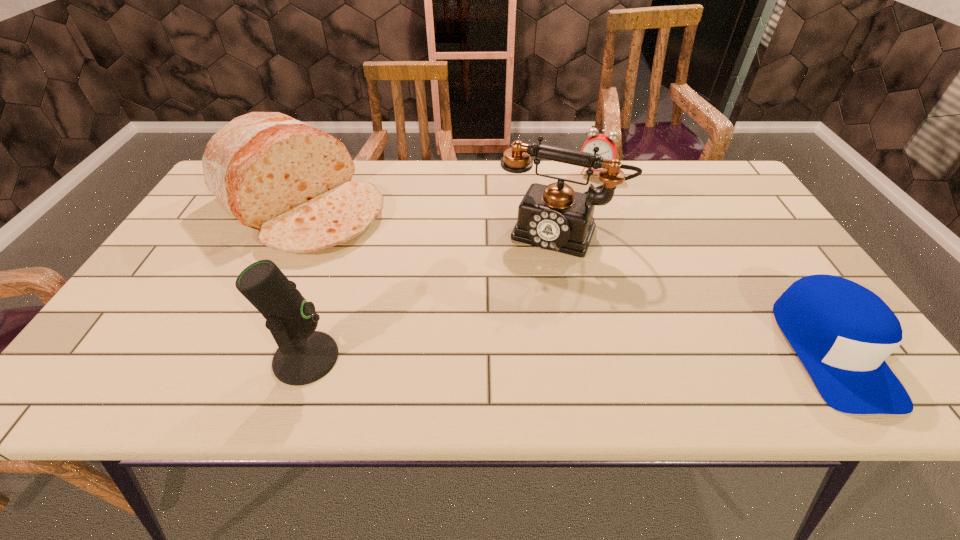
Where is `microphone`? This screenshot has height=540, width=960. microphone is located at coordinates (304, 355).

Locate an element on the screen. the rightmost object is located at coordinates (842, 332).

Where is `telephone`? telephone is located at coordinates (554, 217).

The height and width of the screenshot is (540, 960). What are the coordinates of `alarm clock` in the screenshot? It's located at (607, 147).

What are the coordinates of `bread` in the screenshot? It's located at (292, 182).

Locate an element on the screen. The width and height of the screenshot is (960, 540). vacant space located 0.370m on the back of the microphone is located at coordinates (350, 225).

Where is `blank space located 0.130m on the front of the telephone at the rotary dial`? blank space located 0.130m on the front of the telephone at the rotary dial is located at coordinates (524, 291).

This screenshot has width=960, height=540. Identify the location of free location located 0.050m on the front of the telephone at the rotary dial. (535, 269).

Where is `free space located on the front of the telephone at the rotary dial`? free space located on the front of the telephone at the rotary dial is located at coordinates (521, 297).

Identify the location of free location located on the front-facing side of the alarm clock. This screenshot has width=960, height=540. (564, 241).